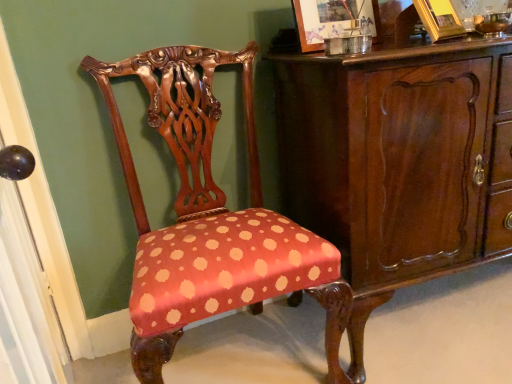
Question: Considering the relative sizes of mahogany wood cabinet at center and gold metallic picture frame at upper right, positioned as the 2th picture frame in left-to-right order, in the image provided, is mahogany wood cabinet at center shorter than gold metallic picture frame at upper right, positioned as the 2th picture frame in left-to-right order,?

Choices:
 (A) yes
 (B) no

Answer: (B)

Question: Is gold metallic picture frame at upper right, which appears as the 1th picture frame when viewed from the right, a part of mahogany wood cabinet at center?

Choices:
 (A) no
 (B) yes

Answer: (A)

Question: Is mahogany wood cabinet at center wider than gold metallic picture frame at upper right, positioned as the 2th picture frame in left-to-right order?

Choices:
 (A) yes
 (B) no

Answer: (A)

Question: Would you say mahogany wood cabinet at center is a long distance from gold metallic picture frame at upper right, which appears as the 1th picture frame when viewed from the right?

Choices:
 (A) no
 (B) yes

Answer: (A)

Question: Does mahogany wood cabinet at center turn towards gold metallic picture frame at upper right, positioned as the 2th picture frame in left-to-right order?

Choices:
 (A) no
 (B) yes

Answer: (A)

Question: Is wooden picture frame at upper center, positioned as the first picture frame in left-to-right order, inside the boundaries of gold metallic picture frame at upper right, positioned as the 2th picture frame in left-to-right order, or outside?

Choices:
 (A) inside
 (B) outside

Answer: (B)

Question: Considering the positions of wooden picture frame at upper center, which appears as the second picture frame when viewed from the right, and gold metallic picture frame at upper right, positioned as the 2th picture frame in left-to-right order, in the image, is wooden picture frame at upper center, which appears as the second picture frame when viewed from the right, taller or shorter than gold metallic picture frame at upper right, positioned as the 2th picture frame in left-to-right order,?

Choices:
 (A) tall
 (B) short

Answer: (A)

Question: Relative to gold metallic picture frame at upper right, positioned as the 2th picture frame in left-to-right order, is wooden picture frame at upper center, positioned as the first picture frame in left-to-right order, in front or behind?

Choices:
 (A) behind
 (B) front

Answer: (A)

Question: From the image's perspective, is wooden picture frame at upper center, which appears as the second picture frame when viewed from the right, above or below gold metallic picture frame at upper right, positioned as the 2th picture frame in left-to-right order?

Choices:
 (A) below
 (B) above

Answer: (A)

Question: From a real-world perspective, is wooden picture frame at upper center, which appears as the second picture frame when viewed from the right, above or below mahogany wood cabinet at center?

Choices:
 (A) above
 (B) below

Answer: (A)

Question: Considering their positions, is wooden picture frame at upper center, which appears as the second picture frame when viewed from the right, located in front of or behind mahogany wood cabinet at center?

Choices:
 (A) behind
 (B) front

Answer: (A)

Question: Would you say wooden picture frame at upper center, which appears as the second picture frame when viewed from the right, is inside or outside mahogany wood cabinet at center?

Choices:
 (A) inside
 (B) outside

Answer: (B)

Question: From their relative heights in the image, would you say wooden picture frame at upper center, which appears as the second picture frame when viewed from the right, is taller or shorter than mahogany wood cabinet at center?

Choices:
 (A) tall
 (B) short

Answer: (B)

Question: From the image's perspective, is polka dot fabric chair at center positioned above or below mahogany wood cabinet at center?

Choices:
 (A) above
 (B) below

Answer: (B)

Question: Is polka dot fabric chair at center wider or thinner than mahogany wood cabinet at center?

Choices:
 (A) wide
 (B) thin

Answer: (B)